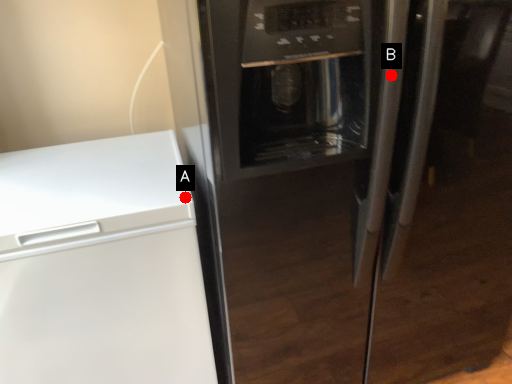
Question: Two points are circled on the image, labeled by A and B beside each circle. Which point is farther from the camera taking this photo?

Choices:
 (A) A is further
 (B) B is further

Answer: (A)